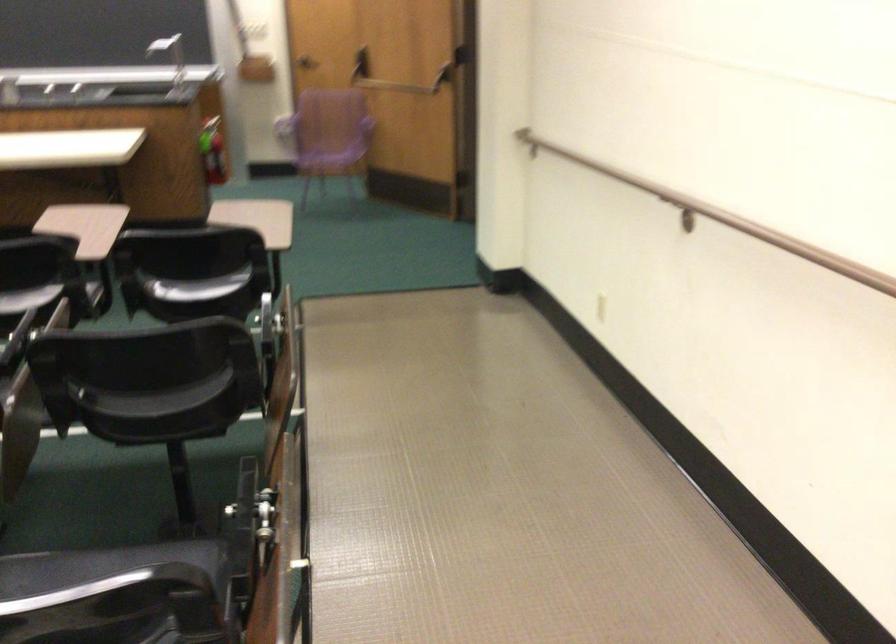
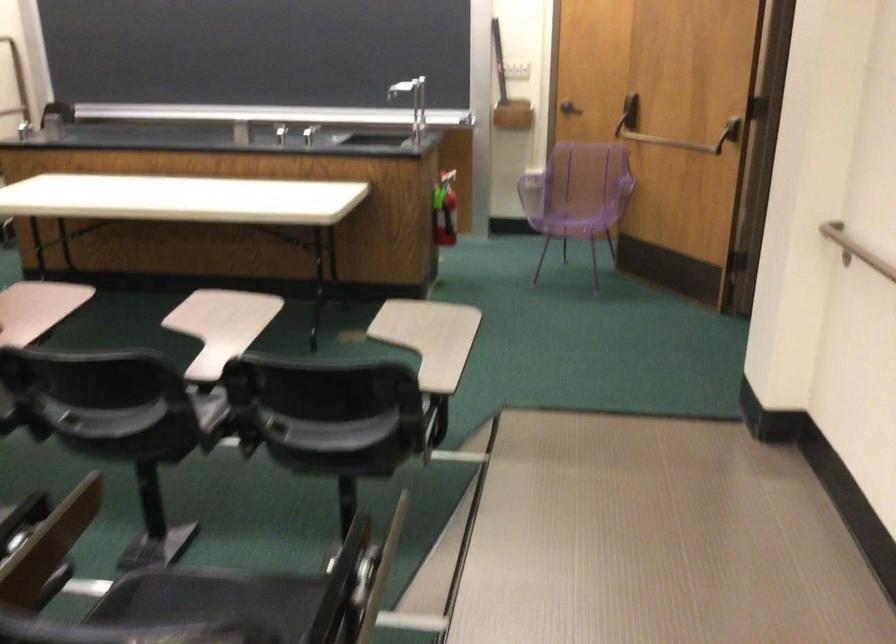
Question: The images are taken continuously from a first-person perspective. In which direction are you moving?

Choices:
 (A) Left
 (B) Right
 (C) Forward
 (D) Backward

Answer: (C)